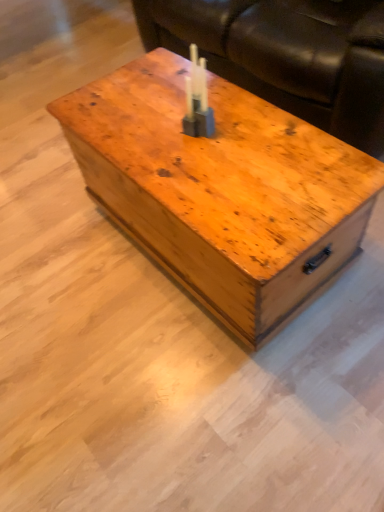
This screenshot has height=512, width=384. What are the coordinates of `vacant region in front of translucent plastic candle at center` in the screenshot? It's located at (208, 167).